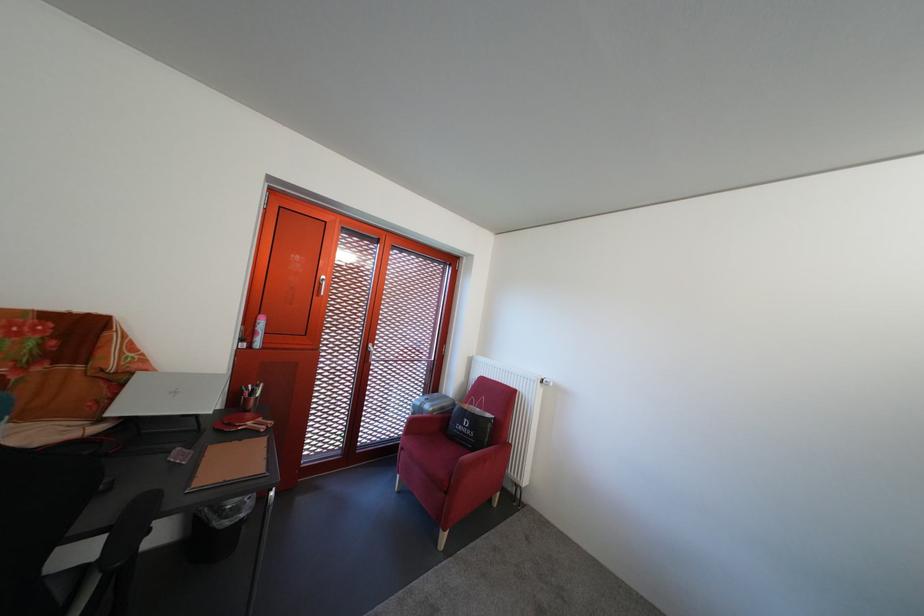
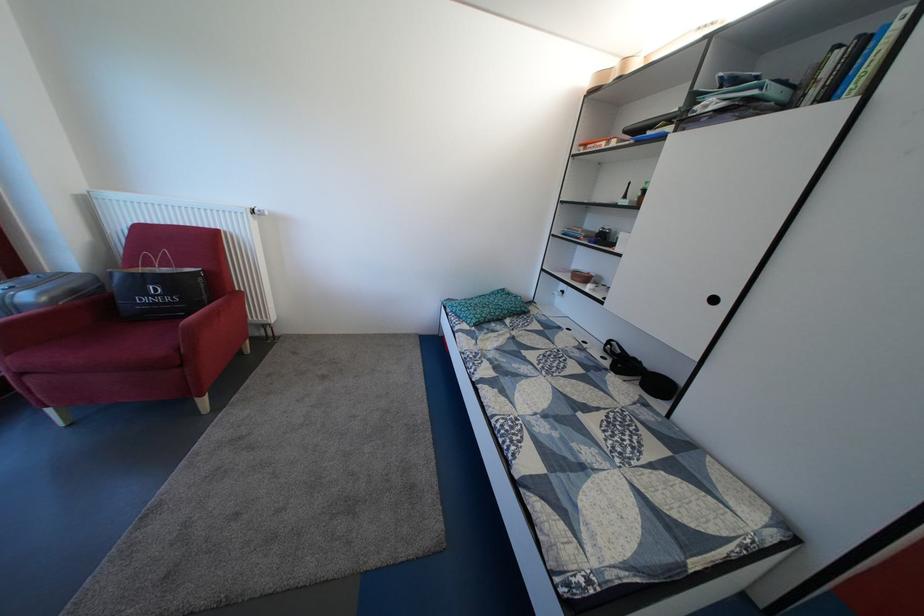
Question: I am providing you with two images of the same scene from different viewpoints. Which of the following objects are not visible in image2?

Choices:
 (A) brown ceramic bowl
 (B) red chair sitting surface
 (C) red chair armrest
 (D) none of these

Answer: (D)